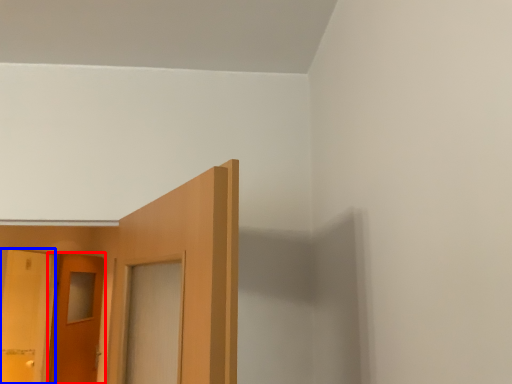
Question: Among these objects, which one is nearest to the camera, door (highlighted by a red box) or door (highlighted by a blue box)?

Choices:
 (A) door
 (B) door

Answer: (B)